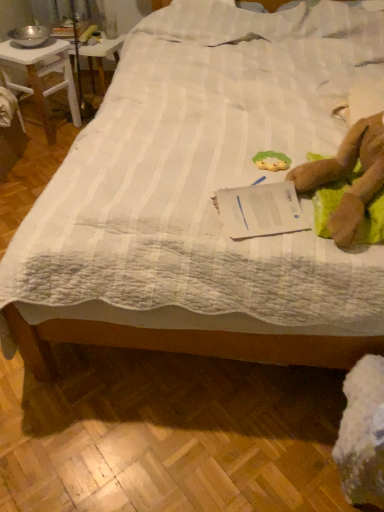
Question: Does metallic silver bowl at upper left have a larger size compared to white wood desk at upper left?

Choices:
 (A) yes
 (B) no

Answer: (B)

Question: From a real-world perspective, is metallic silver bowl at upper left on top of white wood desk at upper left?

Choices:
 (A) no
 (B) yes

Answer: (A)

Question: From the image's perspective, is metallic silver bowl at upper left under white wood desk at upper left?

Choices:
 (A) no
 (B) yes

Answer: (A)

Question: Does metallic silver bowl at upper left have a greater height compared to white wood desk at upper left?

Choices:
 (A) no
 (B) yes

Answer: (A)

Question: Is metallic silver bowl at upper left aimed at white wood desk at upper left?

Choices:
 (A) yes
 (B) no

Answer: (B)

Question: From the image's perspective, is brown plush toy at right located above or below white wood desk at upper left?

Choices:
 (A) below
 (B) above

Answer: (A)

Question: In terms of width, does brown plush toy at right look wider or thinner when compared to white wood desk at upper left?

Choices:
 (A) thin
 (B) wide

Answer: (B)

Question: Would you say brown plush toy at right is inside or outside white wood desk at upper left?

Choices:
 (A) inside
 (B) outside

Answer: (B)

Question: Considering the positions of brown plush toy at right and white wood desk at upper left in the image, is brown plush toy at right taller or shorter than white wood desk at upper left?

Choices:
 (A) short
 (B) tall

Answer: (A)

Question: In terms of height, does green fabric toy at center look taller or shorter compared to white quilted bed at center?

Choices:
 (A) short
 (B) tall

Answer: (A)

Question: Do you think green fabric toy at center is within white quilted bed at center, or outside of it?

Choices:
 (A) outside
 (B) inside

Answer: (B)

Question: In the image, is green fabric toy at center positioned in front of or behind white quilted bed at center?

Choices:
 (A) front
 (B) behind

Answer: (B)

Question: Looking at the image, does green fabric toy at center seem bigger or smaller compared to white quilted bed at center?

Choices:
 (A) small
 (B) big

Answer: (A)

Question: Is green fabric toy at center in front of or behind white paper at center in the image?

Choices:
 (A) front
 (B) behind

Answer: (B)

Question: Based on their sizes in the image, would you say green fabric toy at center is bigger or smaller than white paper at center?

Choices:
 (A) small
 (B) big

Answer: (A)